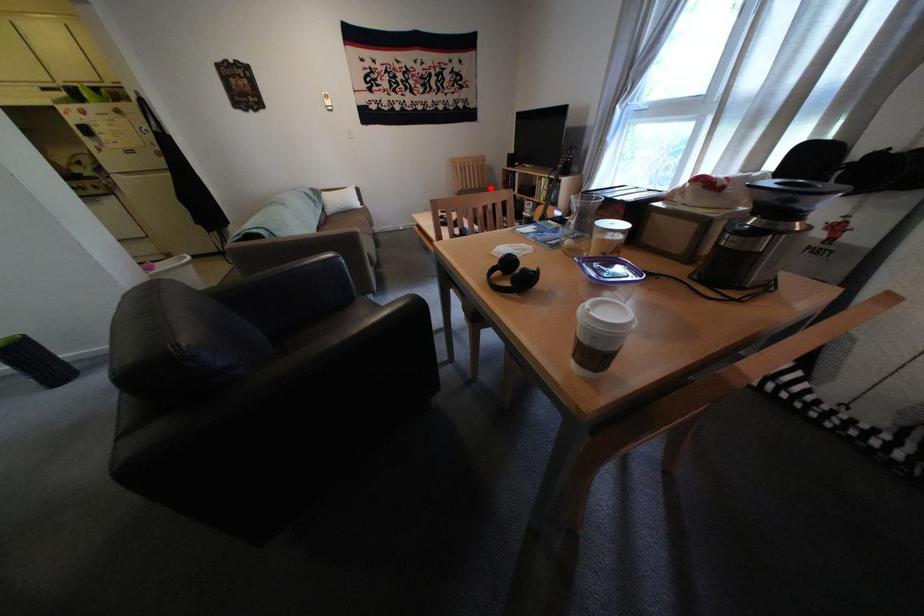
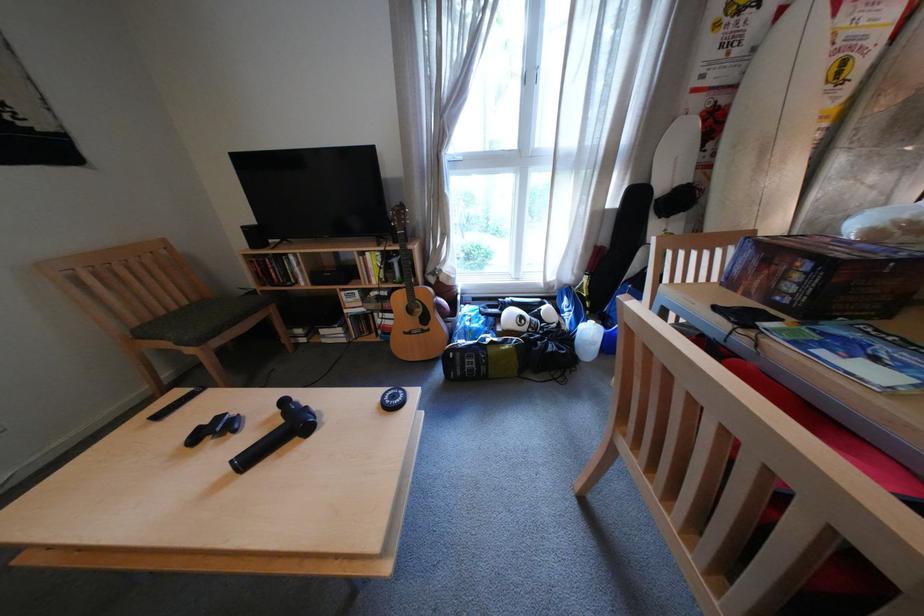
Question: A red point is marked in image1. In image2, is the corresponding 3D point closer to the camera or farther? Reply with the corresponding letter.

Choices:
 (A) The corresponding 3D point is closer.
 (B) The corresponding 3D point is farther.

Answer: (A)